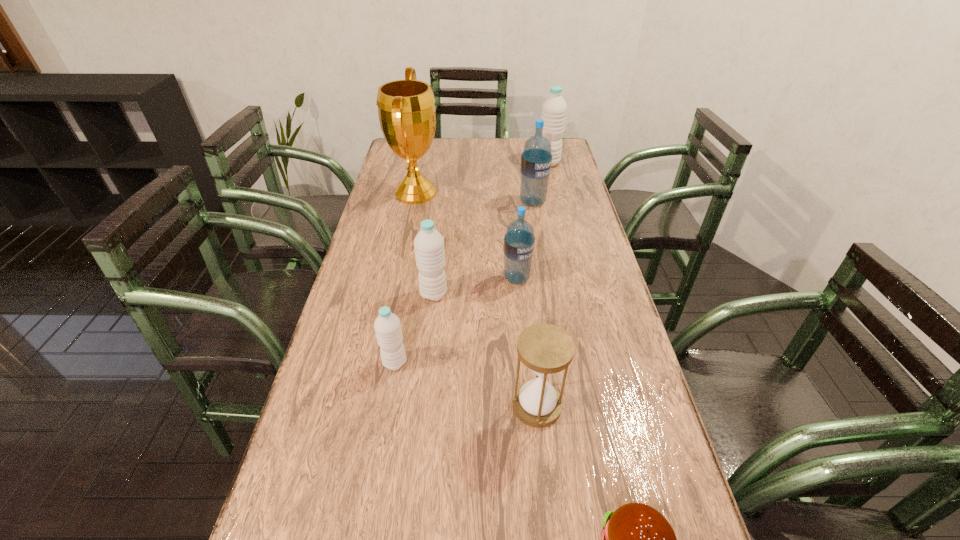
You are a GUI agent. You are given a task and a screenshot of the screen. Output one action in this format:
    pyautogui.click(x=<x>, y=<y>)
    Task: Click on the blue water bottle that is the second nearest to the award
    This screenshot has width=960, height=540.
    Given the screenshot: What is the action you would take?
    click(x=519, y=240)

The height and width of the screenshot is (540, 960). Identify the location of free space that satisfies the following two spatial constraints: 1. on the back side of the second biggest white water bottle; 2. on the right side of the smaller blue water bottle. (436, 279).